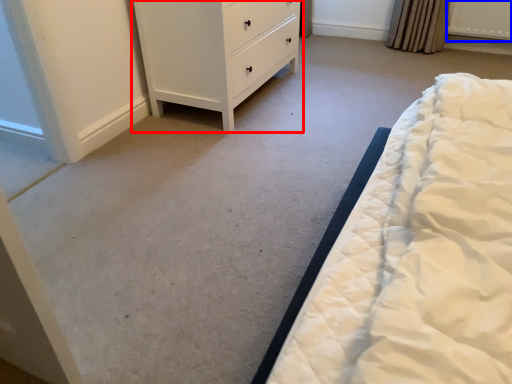
Question: Which point is closer to the camera, chest of drawers (highlighted by a red box) or radiator (highlighted by a blue box)?

Choices:
 (A) chest of drawers
 (B) radiator

Answer: (A)